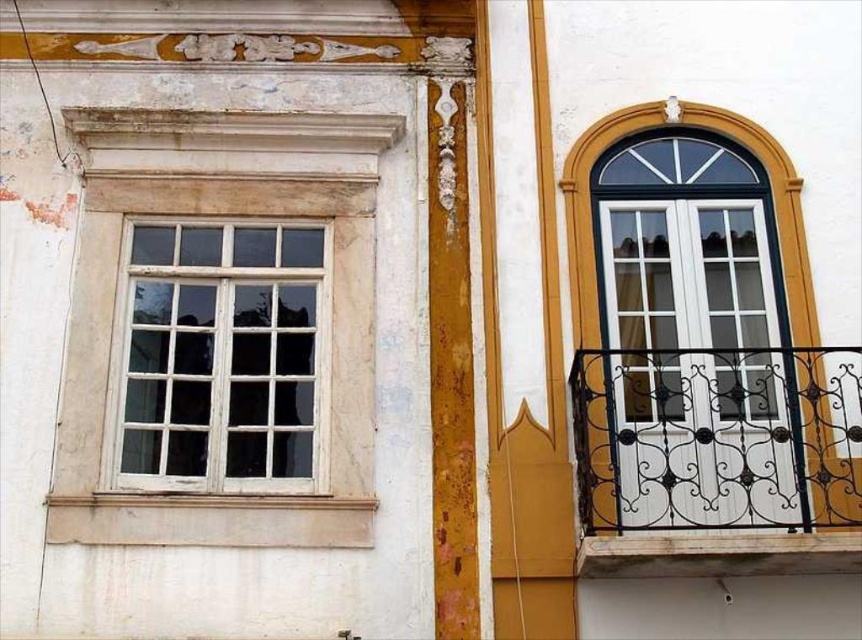
You are standing in front of the building and see the white wrought iron balcony at right located at point (717, 460). Is the balcony closer to the left window or the arched window?

The white wrought iron balcony at right is closer to the arched window because it is located at point (717, 460), which is near the right side of the building where the arched window is situated.

You are standing at the base of the building and want to reach the white wooden window at left from the white wrought iron balcony at right. Can you walk directly between them?

The white wrought iron balcony at right is 3.17 meters away from the white wooden window at left, so yes, you can walk directly between them as the distance is sufficient for movement.